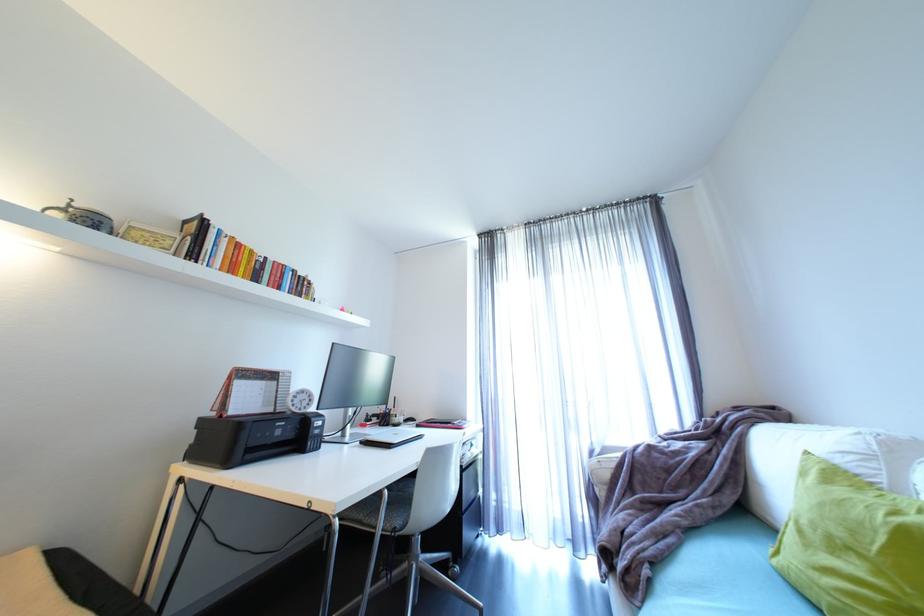
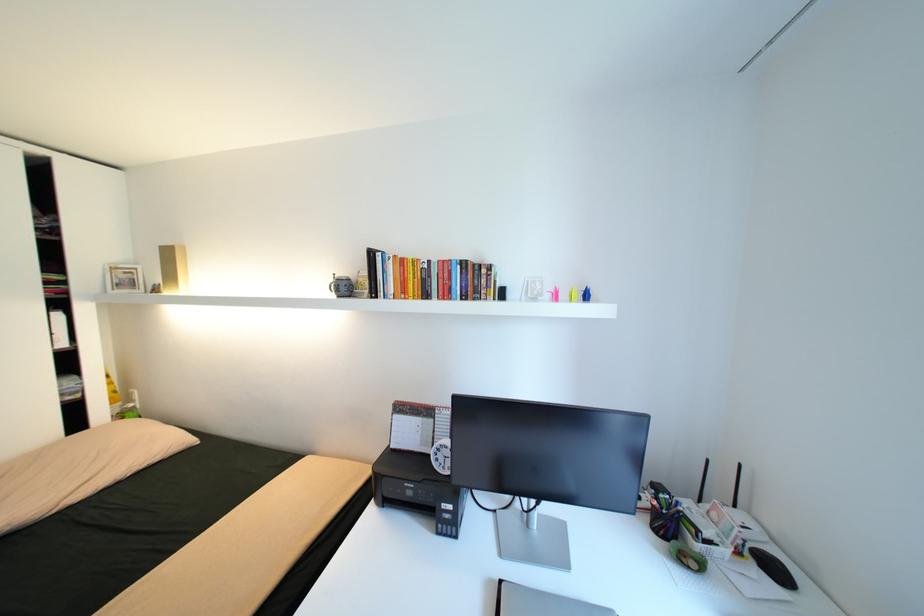
In the second image, find the point that corresponds to [300,405] in the first image.

(444, 460)